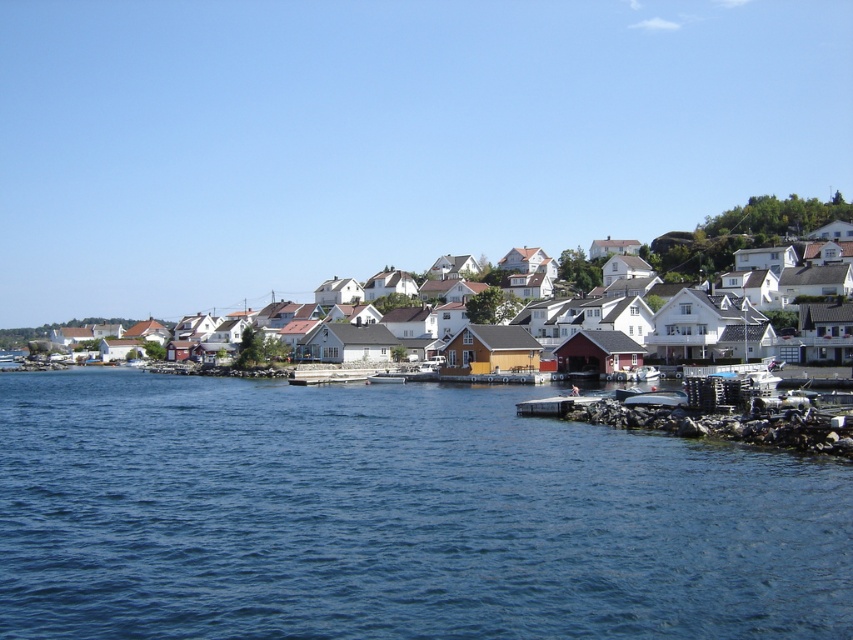
You are standing at the point with coordinates point (683, 404) and want to walk towards the point with coordinates point (552, 403). Based on the scene description, will the point you are walking towards be visible to you as you move forward?

Point (552, 403) is behind point (683, 404), so as you walk towards point (552, 403) from point (683, 404), it will become visible once you pass point (683, 404).

You are standing at the point marked as point (756, 256) in the coastal village scene. Looking around, you notice the white wooden houses at center. Which direction should you walk to reach the calm dark blue waters in the foreground?

Since point (756, 256) is on the white wooden houses at center, you should walk towards the lower part of the image to reach the calm dark blue waters in the foreground.

You are standing at the edge of the water in the coastal village scene. You see a point marked at coordinates (553,404). Where is this point located in relation to the smooth concrete dock at lower center?

The point is located on the smooth concrete dock at lower center.